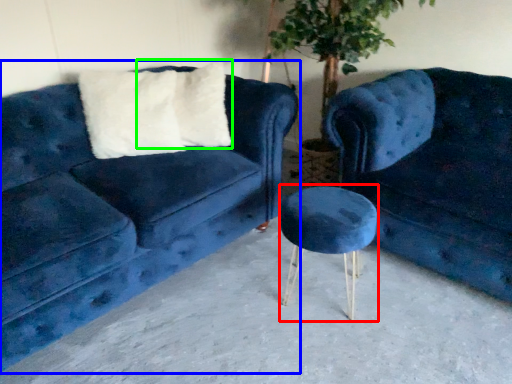
Question: Which object is the closest to the bar stool (highlighted by a red box)? Choose among these: studio couch (highlighted by a blue box) or pillow (highlighted by a green box).

Choices:
 (A) studio couch
 (B) pillow

Answer: (A)